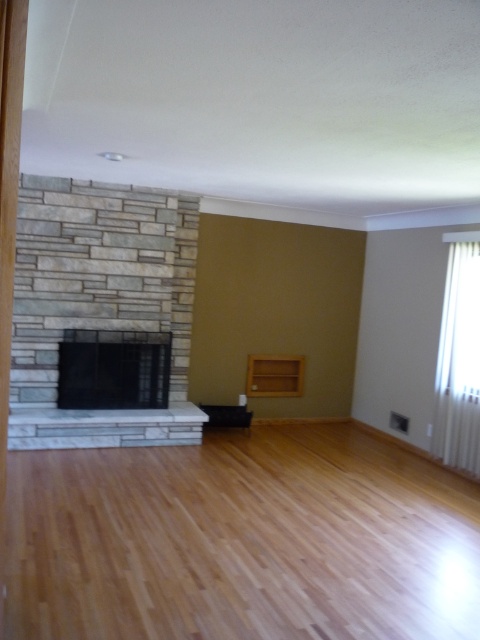
Question: Does white marble fireplace at center appear under light brown wood shelf at center?

Choices:
 (A) no
 (B) yes

Answer: (B)

Question: Where is black glass fireplace at center located in relation to white marble fireplace at center in the image?

Choices:
 (A) below
 (B) above

Answer: (B)

Question: Which is nearer to the black glass fireplace at center?

Choices:
 (A) white plastic radiator at right
 (B) light brown wood shelf at center
 (C) white marble fireplace at center

Answer: (C)

Question: Does white plastic radiator at right come in front of light brown wood shelf at center?

Choices:
 (A) yes
 (B) no

Answer: (A)

Question: Which point is closer to the camera taking this photo?

Choices:
 (A) (201, 422)
 (B) (252, 380)
 (C) (479, 476)
 (D) (59, 344)

Answer: (C)

Question: Which object is the closest to the light brown wood shelf at center?

Choices:
 (A) white marble fireplace at center
 (B) white plastic radiator at right
 (C) black glass fireplace at center

Answer: (A)